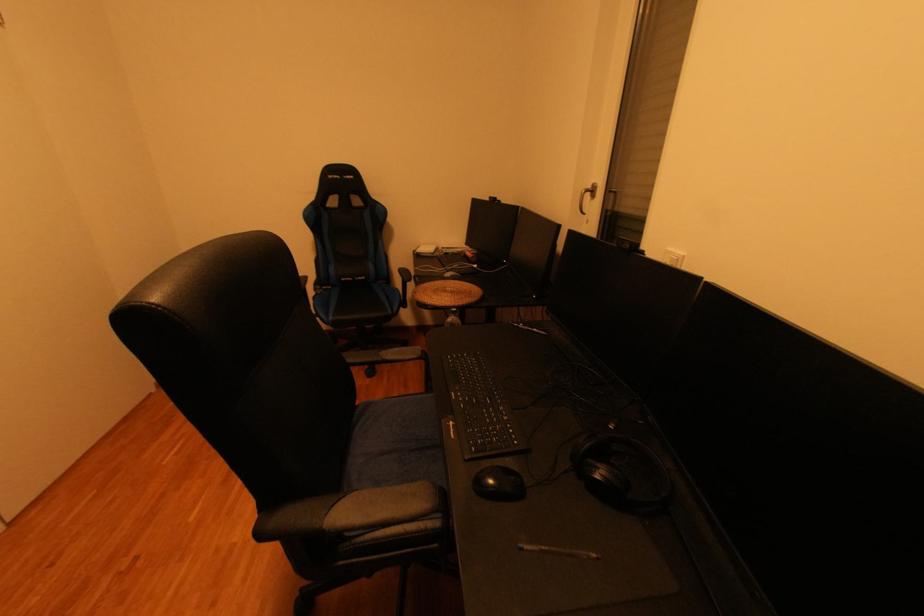
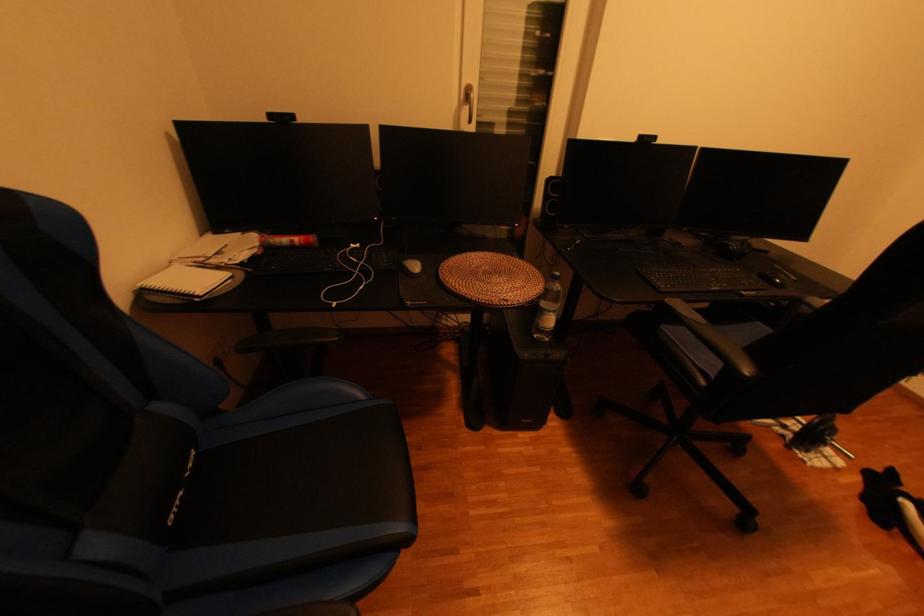
The point at (x=367, y=278) is marked in the first image. Where is the corresponding point in the second image?

(197, 477)